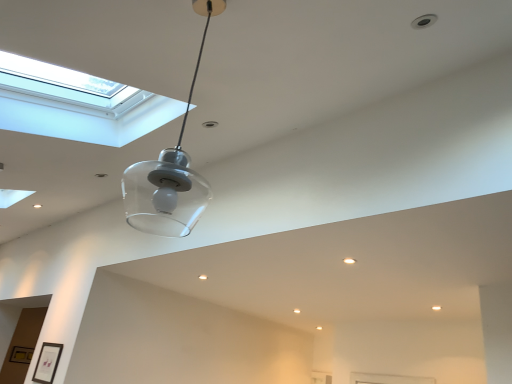
Question: Would you say matte black picture frame at lower left, positioned as the first picture frame in top-to-bottom order, is a long distance from gold metallic picture frame at lower left, the first picture frame from the back?

Choices:
 (A) no
 (B) yes

Answer: (B)

Question: From a real-world perspective, is matte black picture frame at lower left, the first picture frame from the right, positioned over gold metallic picture frame at lower left, the first picture frame from the back, based on gravity?

Choices:
 (A) no
 (B) yes

Answer: (A)

Question: Would you say matte black picture frame at lower left, positioned as the first picture frame in top-to-bottom order, is outside gold metallic picture frame at lower left, marked as the first picture frame in a bottom-to-top arrangement?

Choices:
 (A) yes
 (B) no

Answer: (A)

Question: Is matte black picture frame at lower left, the first picture frame from the right, shorter than gold metallic picture frame at lower left, marked as the first picture frame in a bottom-to-top arrangement?

Choices:
 (A) yes
 (B) no

Answer: (B)

Question: From the image's perspective, is matte black picture frame at lower left, which is the second picture frame in back-to-front order, located beneath gold metallic picture frame at lower left, which is counted as the first picture frame, starting from the left?

Choices:
 (A) no
 (B) yes

Answer: (A)

Question: Does point (53, 344) appear closer or farther from the camera than point (74, 82)?

Choices:
 (A) closer
 (B) farther

Answer: (B)

Question: From the image's perspective, is matte black picture frame at lower left, positioned as the first picture frame in top-to-bottom order, located above or below transparent glass window at upper left?

Choices:
 (A) above
 (B) below

Answer: (B)

Question: From a real-world perspective, is matte black picture frame at lower left, which is the second picture frame in back-to-front order, positioned above or below transparent glass window at upper left?

Choices:
 (A) below
 (B) above

Answer: (A)

Question: In terms of height, does matte black picture frame at lower left, arranged as the second picture frame when ordered from the bottom, look taller or shorter compared to transparent glass window at upper left?

Choices:
 (A) short
 (B) tall

Answer: (A)

Question: In terms of height, does transparent glass window at upper left look taller or shorter compared to matte black picture frame at lower left, which is the second picture frame in back-to-front order?

Choices:
 (A) tall
 (B) short

Answer: (A)

Question: Is transparent glass window at upper left in front of or behind matte black picture frame at lower left, arranged as the second picture frame when ordered from the bottom, in the image?

Choices:
 (A) front
 (B) behind

Answer: (A)

Question: Is transparent glass window at upper left wider or thinner than matte black picture frame at lower left, arranged as the second picture frame when ordered from the bottom?

Choices:
 (A) thin
 (B) wide

Answer: (B)

Question: Looking at the image, does transparent glass window at upper left seem bigger or smaller compared to matte black picture frame at lower left, the first picture frame from the right?

Choices:
 (A) big
 (B) small

Answer: (A)

Question: Based on their sizes in the image, would you say matte black picture frame at lower left, arranged as the second picture frame when ordered from the bottom, is bigger or smaller than gold metallic picture frame at lower left, acting as the 2th picture frame starting from the top?

Choices:
 (A) small
 (B) big

Answer: (B)

Question: Considering their positions, is matte black picture frame at lower left, the 2th picture frame from the left, located in front of or behind gold metallic picture frame at lower left, which is the 2th picture frame in front-to-back order?

Choices:
 (A) behind
 (B) front

Answer: (B)